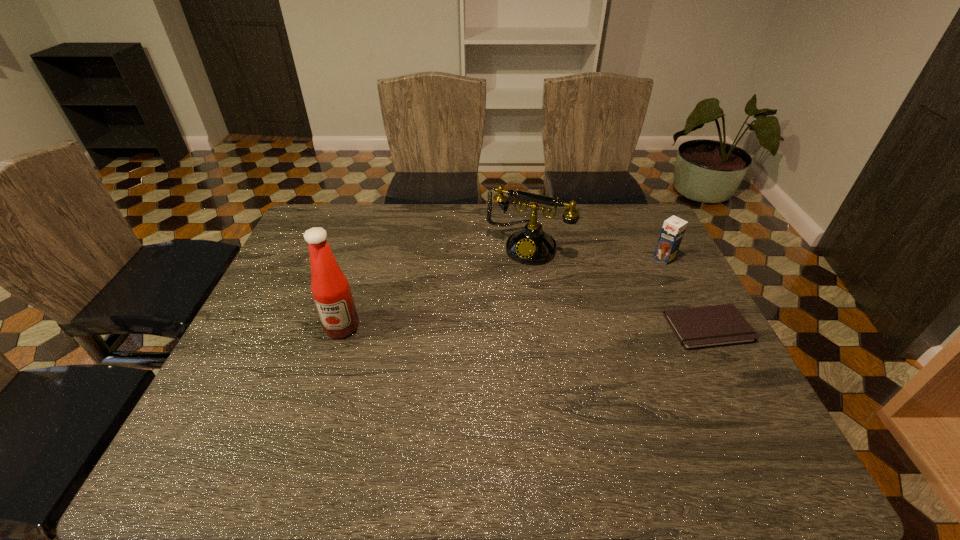
You are a GUI agent. You are given a task and a screenshot of the screen. Output one action in this format:
    pyautogui.click(x=<x>, y=<y>)
    Task: Click on the tallest object
    This screenshot has height=540, width=960.
    Given the screenshot: What is the action you would take?
    pyautogui.click(x=330, y=288)

This screenshot has height=540, width=960. Identify the location of condiment. (330, 288).

Identify the location of the shortest object. The height and width of the screenshot is (540, 960). (720, 325).

This screenshot has width=960, height=540. I want to click on the third tallest object, so click(x=673, y=229).

Locate an element on the screen. telephone is located at coordinates (531, 245).

Find the location of `the third object from right to left`. the third object from right to left is located at coordinates (531, 245).

Where is `vacant space positioned on the front-facing side of the condiment`? The width and height of the screenshot is (960, 540). vacant space positioned on the front-facing side of the condiment is located at coordinates (325, 380).

Locate an element on the screen. Image resolution: width=960 pixels, height=540 pixels. vacant space located on the front of the shortest object is located at coordinates (752, 411).

At what (x,y) coordinates should I click in order to perform the action: click on blank space located 0.270m on the front label of the chocolate milk. Please return your answer as a coordinate pair (x, y). Image resolution: width=960 pixels, height=540 pixels. Looking at the image, I should click on (602, 302).

Locate an element on the screen. This screenshot has width=960, height=540. free region located 0.250m on the front label of the chocolate milk is located at coordinates (606, 299).